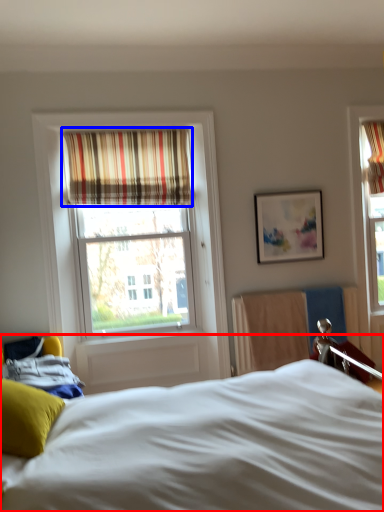
Question: Which point is further to the camera, bed (highlighted by a red box) or curtain (highlighted by a blue box)?

Choices:
 (A) bed
 (B) curtain

Answer: (B)